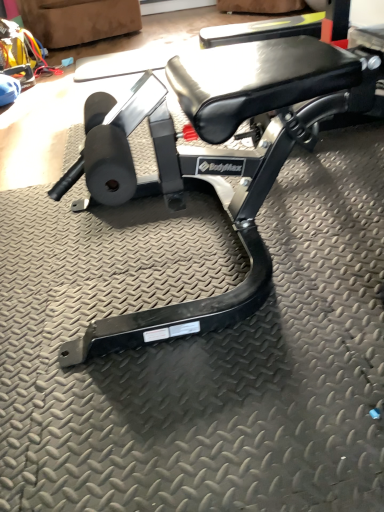
Question: Visually, is suede-like brown swivel chair at upper left positioned to the left or to the right of black matte bench at center?

Choices:
 (A) right
 (B) left

Answer: (B)

Question: From the image's perspective, is suede-like brown swivel chair at upper left positioned above or below black matte bench at center?

Choices:
 (A) below
 (B) above

Answer: (B)

Question: Looking at the image, does suede-like brown swivel chair at upper left seem bigger or smaller compared to black matte bench at center?

Choices:
 (A) big
 (B) small

Answer: (B)

Question: Considering their positions, is black matte bench at center located in front of or behind suede-like brown swivel chair at upper left?

Choices:
 (A) behind
 (B) front

Answer: (B)

Question: From a real-world perspective, is black matte bench at center physically located above or below suede-like brown swivel chair at upper left?

Choices:
 (A) above
 (B) below

Answer: (B)

Question: In terms of height, does black matte bench at center look taller or shorter compared to suede-like brown swivel chair at upper left?

Choices:
 (A) short
 (B) tall

Answer: (A)

Question: Considering the relative positions of black matte bench at center and suede-like brown swivel chair at upper left in the image provided, is black matte bench at center to the left or to the right of suede-like brown swivel chair at upper left?

Choices:
 (A) right
 (B) left

Answer: (A)